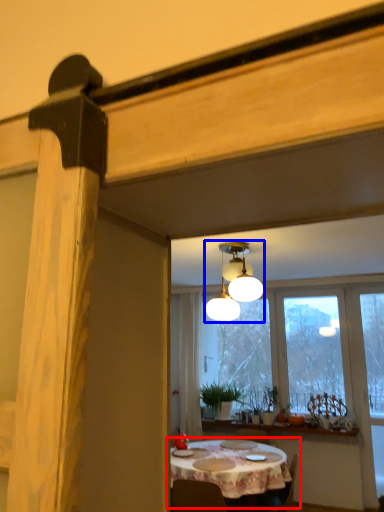
Question: Which of the following is the farthest to the observer, kitchen & dining room table (highlighted by a red box) or lamp (highlighted by a blue box)?

Choices:
 (A) kitchen & dining room table
 (B) lamp

Answer: (A)